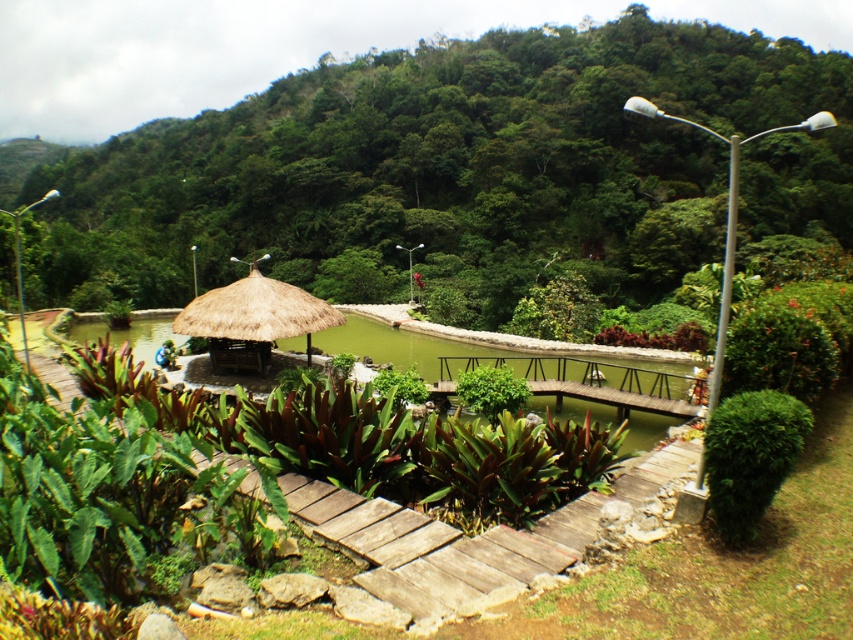
You are a gardener planning to place a decorative stone statue exactly at the center of the green grassy water at center. However, you also need to ensure that the statue won not block the view of the thatched straw umbrella at center from the main garden path. Based on the scene description, can you determine if the statue placement will be visible from the path?

The green grassy water at center is wider than the thatched straw umbrella at center, so placing the statue at the center of the green grassy water at center would likely block the view of the thatched straw umbrella at center from the path. Choose a different location for the statue to maintain visibility.

You are a visitor in the tropical garden and want to take a photo of the thatched straw umbrella at center and the green grassy water at center. Where should you position yourself to capture both in the same frame?

To capture both the thatched straw umbrella at center and the green grassy water at center in the same frame, position yourself above the green grassy water at center since it is located below the thatched straw umbrella at center.

You are a visitor in the garden and want to take a photo of both the green leafy plants at center and the green grassy water at center. Which one should you focus on first if you want to capture both in the same frame?

You should focus on the green leafy plants at center first because it is positioned on the left side of the green grassy water at center, allowing both to be captured in the same frame when starting from the left.